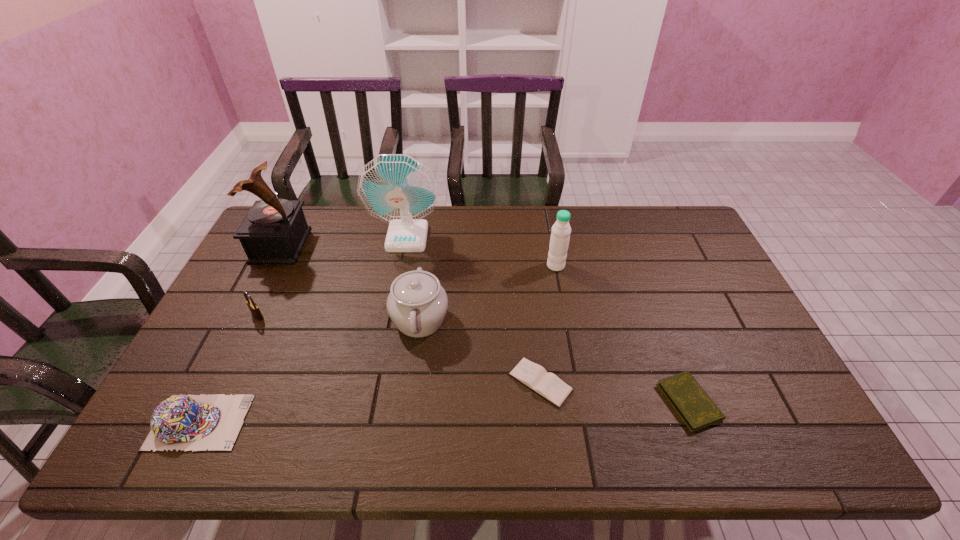
Image resolution: width=960 pixels, height=540 pixels. What are the coordinates of `fan` in the screenshot? It's located at (396, 188).

Where is `phonograph_record`? Image resolution: width=960 pixels, height=540 pixels. phonograph_record is located at coordinates (274, 231).

Where is `water bottle`? water bottle is located at coordinates (559, 241).

This screenshot has height=540, width=960. Find the location of `the fifth shortest object`. the fifth shortest object is located at coordinates (417, 304).

You are a GUI agent. You are given a task and a screenshot of the screen. Output one action in this format:
    pyautogui.click(x=<x>, y=<y>)
    Task: Click on the fourth shortest object
    The width and height of the screenshot is (960, 540).
    Given the screenshot: What is the action you would take?
    pyautogui.click(x=254, y=309)

Find the location of a particular element. the sixth tallest object is located at coordinates (183, 422).

Find the location of a particular element. Image resolution: width=960 pixels, height=540 pixels. the left diary is located at coordinates (546, 384).

This screenshot has height=540, width=960. What are the coordinates of `the rightmost object` in the screenshot? It's located at (697, 410).

Identify the location of free space located in front of the fan to face the airflow. (399, 280).

Where is `vacant space located at the horn opening of the phonograph_record`? vacant space located at the horn opening of the phonograph_record is located at coordinates (357, 246).